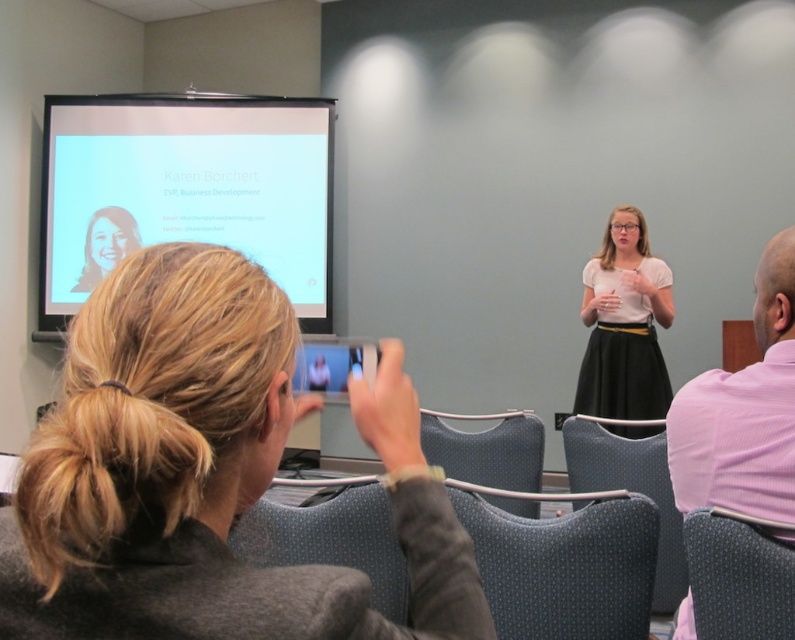
Is blonde hair at upper left behind matte black portrait at upper left?

No, blonde hair at upper left is closer to the viewer.

Identify the location of blonde hair at upper left. The height and width of the screenshot is (640, 795). (206, 474).

The image size is (795, 640). What are the coordinates of `blonde hair at upper left` in the screenshot? It's located at (206, 474).

Who is higher up, white matte projection screen at upper left or velvet-like dark gray chair at lower right?

Positioned higher is white matte projection screen at upper left.

Locate an element on the screen. white matte projection screen at upper left is located at coordinates (185, 189).

Is point (611, 548) in front of point (728, 401)?

No, (611, 548) is behind (728, 401).

Is dark blue textured fabric chair at center to the left of pink textured shirt at right from the viewer's perspective?

Indeed, dark blue textured fabric chair at center is positioned on the left side of pink textured shirt at right.

The width and height of the screenshot is (795, 640). Describe the element at coordinates (565, 566) in the screenshot. I see `dark blue textured fabric chair at center` at that location.

Locate an element on the screen. Image resolution: width=795 pixels, height=640 pixels. dark blue textured fabric chair at center is located at coordinates (565, 566).